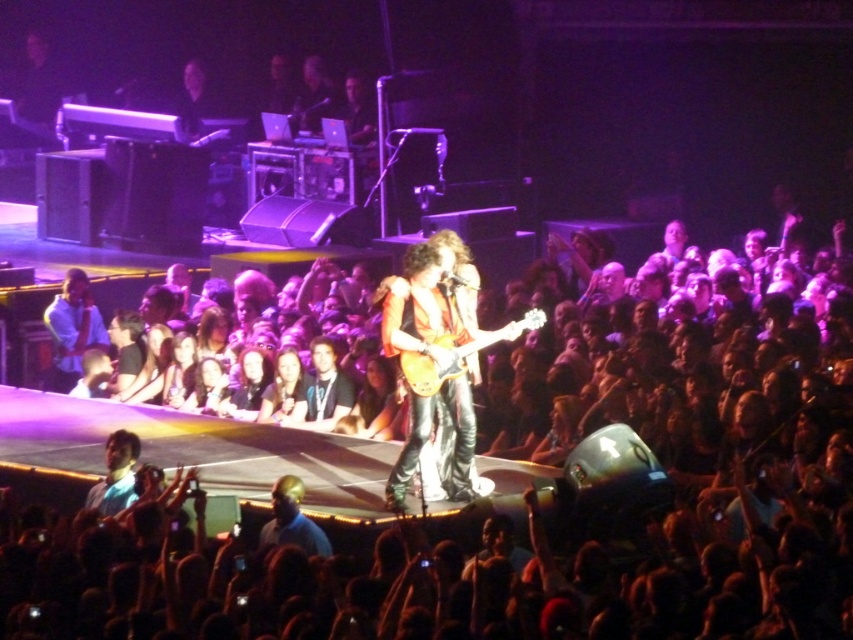
Question: Among these objects, which one is nearest to the camera?

Choices:
 (A) glossy wood guitar at center
 (B) smooth skin crowd at center

Answer: (B)

Question: Does smooth skin crowd at center lie in front of glossy wood guitar at center?

Choices:
 (A) no
 (B) yes

Answer: (B)

Question: Considering the relative positions of smooth skin crowd at center and glossy wood guitar at center in the image provided, where is smooth skin crowd at center located with respect to glossy wood guitar at center?

Choices:
 (A) above
 (B) below

Answer: (B)

Question: Does smooth skin crowd at center have a larger size compared to glossy wood guitar at center?

Choices:
 (A) yes
 (B) no

Answer: (A)

Question: Which object appears farthest from the camera in this image?

Choices:
 (A) smooth skin crowd at center
 (B) glossy wood guitar at center

Answer: (B)